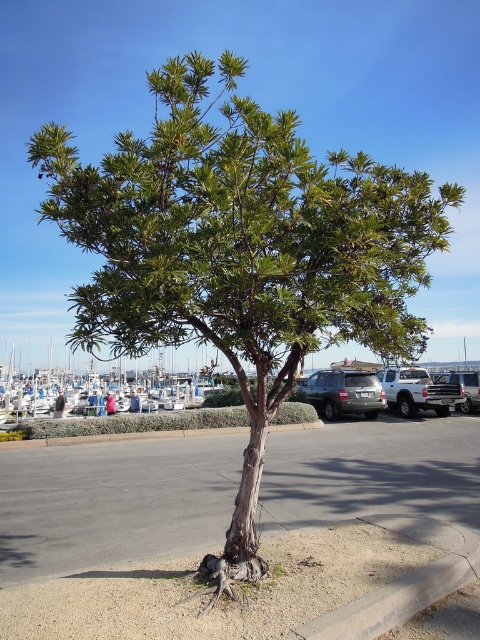
Can you confirm if silver metallic truck at right is smaller than satin black suv at right?

Yes, silver metallic truck at right is smaller than satin black suv at right.

The height and width of the screenshot is (640, 480). Find the location of `silver metallic truck at right`. silver metallic truck at right is located at coordinates (418, 390).

Between point (396, 385) and point (446, 371), which one is positioned in front?

Point (396, 385)

Identify the location of silver metallic truck at right. The height and width of the screenshot is (640, 480). (418, 390).

Which is below, gray concrete curb at lower right or satin black suv at right?

Positioned lower is satin black suv at right.

Which is behind, point (468, 566) or point (453, 380)?

Point (453, 380)

Who is more distant from viewer, (415, 612) or (472, 380)?

Point (472, 380)

Identify the location of gray concrete curb at lower right. (403, 580).

Is satin silver suv at center above silver metallic truck at right?

Incorrect, satin silver suv at center is not positioned above silver metallic truck at right.

In order to click on satin silver suv at center in this screenshot , I will do `click(344, 392)`.

Is point (342, 371) farther from camera compared to point (415, 385)?

No, it is not.

Find the location of a particular element. This screenshot has height=640, width=480. satin silver suv at center is located at coordinates (344, 392).